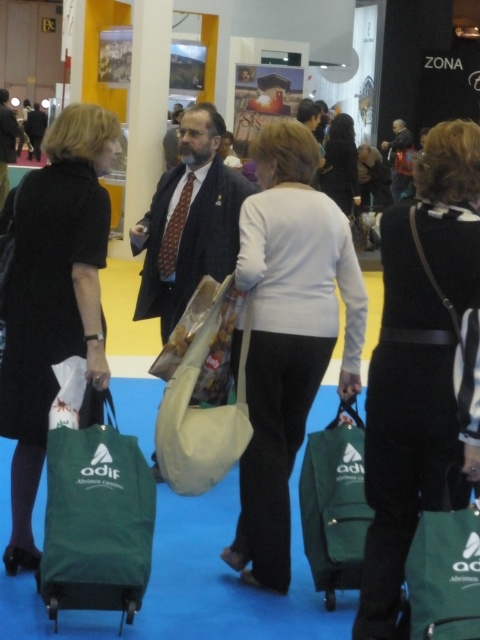
Question: Among these points, which one is farthest from the camera?

Choices:
 (A) (214, 243)
 (B) (322, 531)
 (C) (76, 353)
 (D) (420, 616)

Answer: (A)

Question: Does white matte bag at center have a smaller size compared to beige canvas bag at center?

Choices:
 (A) yes
 (B) no

Answer: (B)

Question: Is green fabric bag at lower left to the left of beige canvas bag at center from the viewer's perspective?

Choices:
 (A) yes
 (B) no

Answer: (A)

Question: Does white matte bag at center appear under black fabric dress at left?

Choices:
 (A) yes
 (B) no

Answer: (A)

Question: Which of the following is the farthest from the observer?

Choices:
 (A) beige canvas bag at center
 (B) white matte bag at center
 (C) black fabric dress at left
 (D) green fabric shopping bag at lower right

Answer: (C)

Question: Which of the following is the closest to the observer?

Choices:
 (A) (12, 547)
 (B) (316, 442)
 (C) (445, 524)
 (D) (242, 336)

Answer: (C)